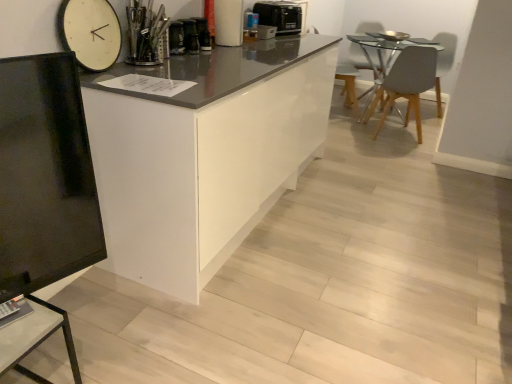
Locate an element on the screen. Image resolution: width=512 pixels, height=384 pixels. free location in front of white glossy cabinet at center is located at coordinates (267, 306).